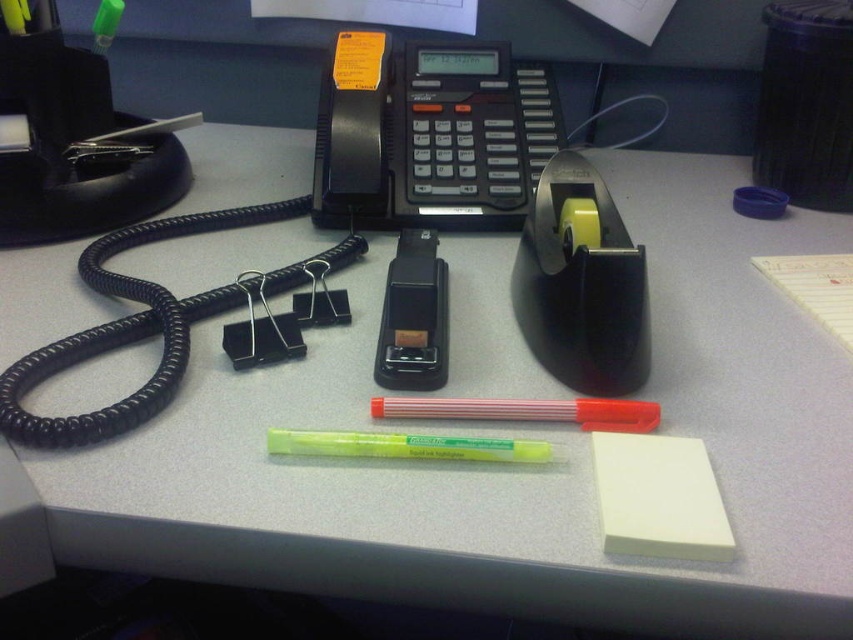
Which is above, black plastic phone at center or translucent red highlighter at center?

black plastic phone at center is above.

Can you confirm if black plastic phone at center is shorter than translucent red highlighter at center?

No.

Find the location of a particular element. The width and height of the screenshot is (853, 640). black plastic phone at center is located at coordinates (428, 134).

Find the location of a particular element. black plastic phone at center is located at coordinates (428, 134).

Between point (581, 412) and point (337, 435), which one is positioned in front?

Positioned in front is point (337, 435).

How much distance is there between translucent red highlighter at center and yellow highlighter at center?

translucent red highlighter at center is 1.41 inches away from yellow highlighter at center.

This screenshot has width=853, height=640. Identify the location of translucent red highlighter at center. (527, 412).

Where is `translucent red highlighter at center`? Image resolution: width=853 pixels, height=640 pixels. translucent red highlighter at center is located at coordinates click(527, 412).

Between point (368, 108) and point (431, 458), which one is positioned in front?

Point (431, 458) is more forward.

The height and width of the screenshot is (640, 853). Describe the element at coordinates (428, 134) in the screenshot. I see `black plastic phone at center` at that location.

Is point (357, 58) closer to viewer compared to point (329, 451)?

No, it is not.

Where is `black plastic phone at center`? The height and width of the screenshot is (640, 853). black plastic phone at center is located at coordinates (x=428, y=134).